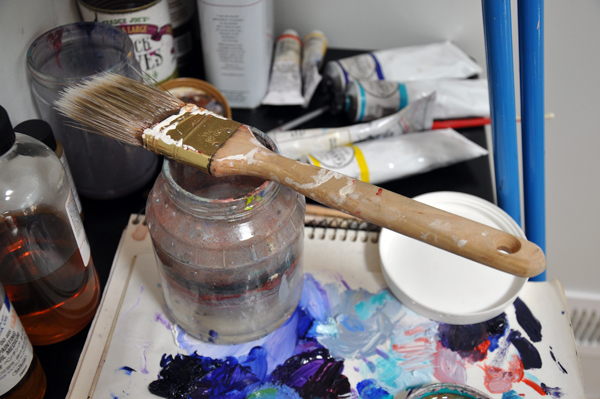
Locate an element on the screen. The width and height of the screenshot is (600, 399). jars is located at coordinates (36, 220), (6, 331), (208, 272), (39, 98), (154, 41).